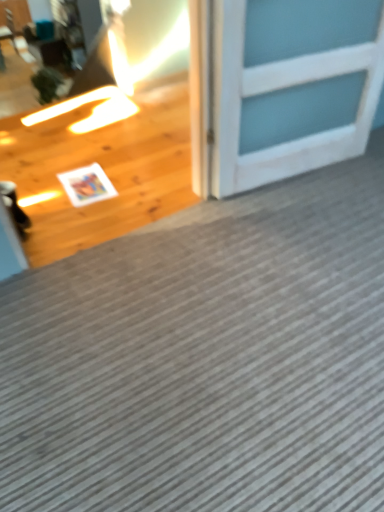
Question: In the image, is gray textured mat at center on the left side or the right side of white wooden door at upper right?

Choices:
 (A) left
 (B) right

Answer: (A)

Question: Relative to white wooden door at upper right, is gray textured mat at center in front or behind?

Choices:
 (A) front
 (B) behind

Answer: (A)

Question: From the image's perspective, is gray textured mat at center positioned above or below white wooden door at upper right?

Choices:
 (A) above
 (B) below

Answer: (B)

Question: From their relative heights in the image, would you say white wooden door at upper right is taller or shorter than gray textured mat at center?

Choices:
 (A) tall
 (B) short

Answer: (A)

Question: In the image, is white wooden door at upper right positioned in front of or behind gray textured mat at center?

Choices:
 (A) behind
 (B) front

Answer: (A)

Question: In terms of size, does white wooden door at upper right appear bigger or smaller than gray textured mat at center?

Choices:
 (A) big
 (B) small

Answer: (B)

Question: Would you say white wooden door at upper right is inside or outside gray textured mat at center?

Choices:
 (A) outside
 (B) inside

Answer: (A)